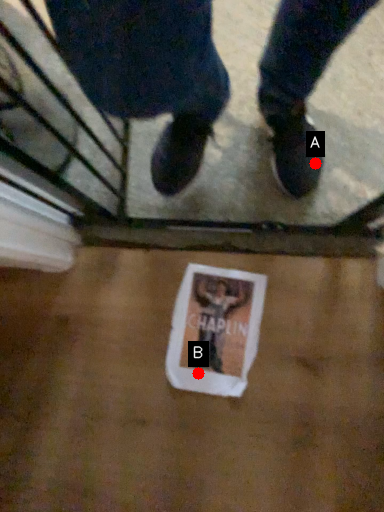
Question: Two points are circled on the image, labeled by A and B beside each circle. Which point appears closest to the camera in this image?

Choices:
 (A) A is closer
 (B) B is closer

Answer: (A)